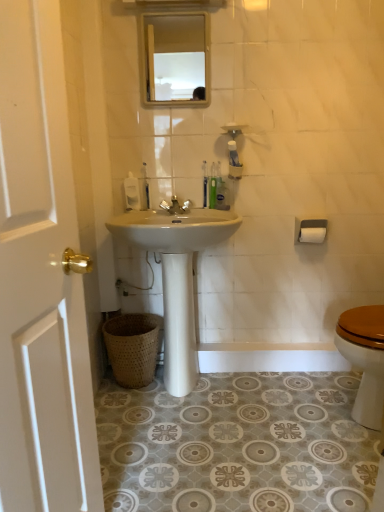
In order to click on unoccupied region to the right of translucent plastic toothbrush at center, placed as the 3th toothbrush when sorted from right to left in this screenshot , I will do 172,212.